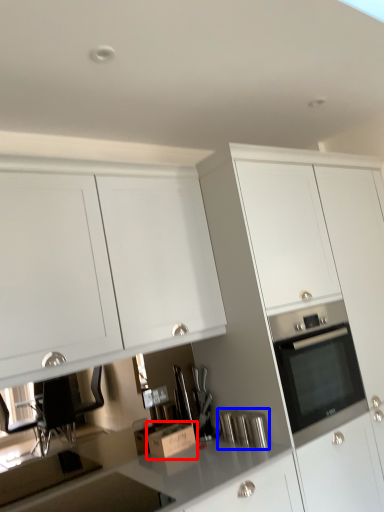
Question: Which point is closer to the camera, cardboard box (highlighted by a red box) or appliance (highlighted by a blue box)?

Choices:
 (A) cardboard box
 (B) appliance

Answer: (B)